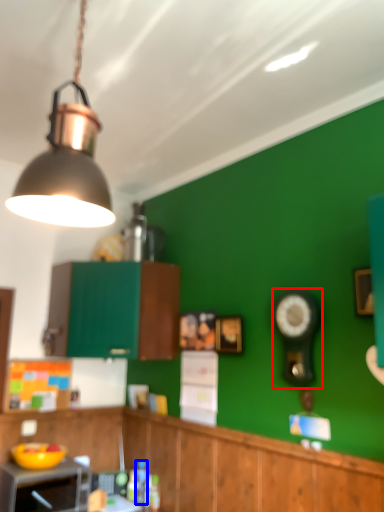
Question: Among these objects, which one is nearest to the camera, clock (highlighted by a red box) or bottle (highlighted by a blue box)?

Choices:
 (A) clock
 (B) bottle

Answer: (A)